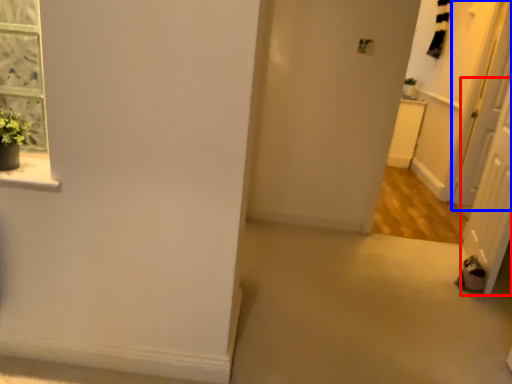
Question: Among these objects, which one is nearest to the camera, screen door (highlighted by a red box) or screen door (highlighted by a blue box)?

Choices:
 (A) screen door
 (B) screen door

Answer: (A)